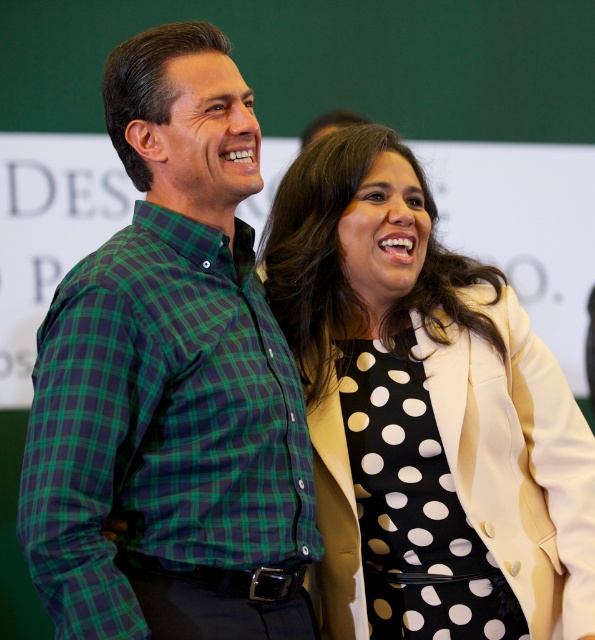
Question: Considering the relative positions of green plaid shirt at center and white dotted dress at center in the image provided, where is green plaid shirt at center located with respect to white dotted dress at center?

Choices:
 (A) above
 (B) below

Answer: (A)

Question: Among these objects, which one is farthest from the camera?

Choices:
 (A) green plaid shirt at center
 (B) white dotted dress at center

Answer: (B)

Question: Considering the relative positions of green plaid shirt at center and white dotted dress at center in the image provided, where is green plaid shirt at center located with respect to white dotted dress at center?

Choices:
 (A) below
 (B) above

Answer: (B)

Question: Is green plaid shirt at center above white dotted dress at center?

Choices:
 (A) yes
 (B) no

Answer: (A)

Question: Which of the following is the farthest from the observer?

Choices:
 (A) green plaid shirt at center
 (B) white dotted dress at center

Answer: (B)